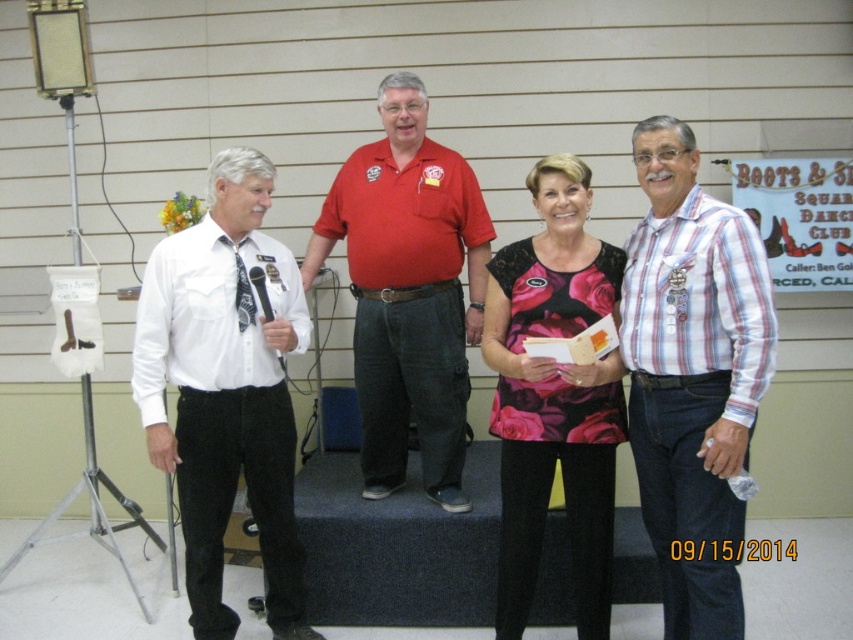
Does white cotton shirt at left have a smaller size compared to floral-patterned fabric dress at center?

No, white cotton shirt at left is not smaller than floral-patterned fabric dress at center.

Is white cotton shirt at left wider than floral-patterned fabric dress at center?

Correct, the width of white cotton shirt at left exceeds that of floral-patterned fabric dress at center.

Does point (273, 552) come behind point (561, 164)?

Yes.

Locate an element on the screen. The height and width of the screenshot is (640, 853). white cotton shirt at left is located at coordinates (225, 388).

In the scene shown: Does white cotton shirt at left appear over red cotton shirt at center?

Actually, white cotton shirt at left is below red cotton shirt at center.

Is point (271, 570) positioned before point (341, 164)?

Yes.

Where is `white cotton shirt at left`? The image size is (853, 640). white cotton shirt at left is located at coordinates (225, 388).

Measure the distance between striped cotton shirt at right and camera.

They are 7.20 feet apart.

Is striped cotton shirt at right below white cotton shirt at left?

No, striped cotton shirt at right is not below white cotton shirt at left.

Measure the distance between striped cotton shirt at right and camera.

striped cotton shirt at right and camera are 2.19 meters apart.

Image resolution: width=853 pixels, height=640 pixels. I want to click on striped cotton shirt at right, so click(x=692, y=376).